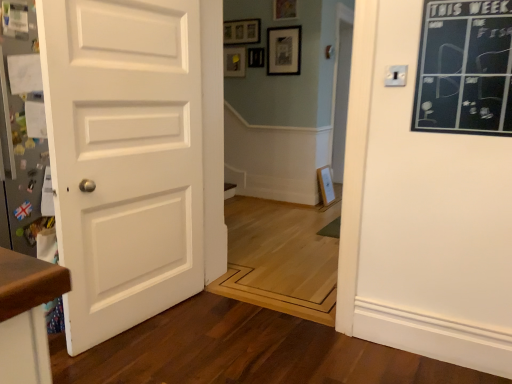
What are the coordinates of `vacant space underneath white matte door at left (from a real-world perspective)` in the screenshot? It's located at (141, 319).